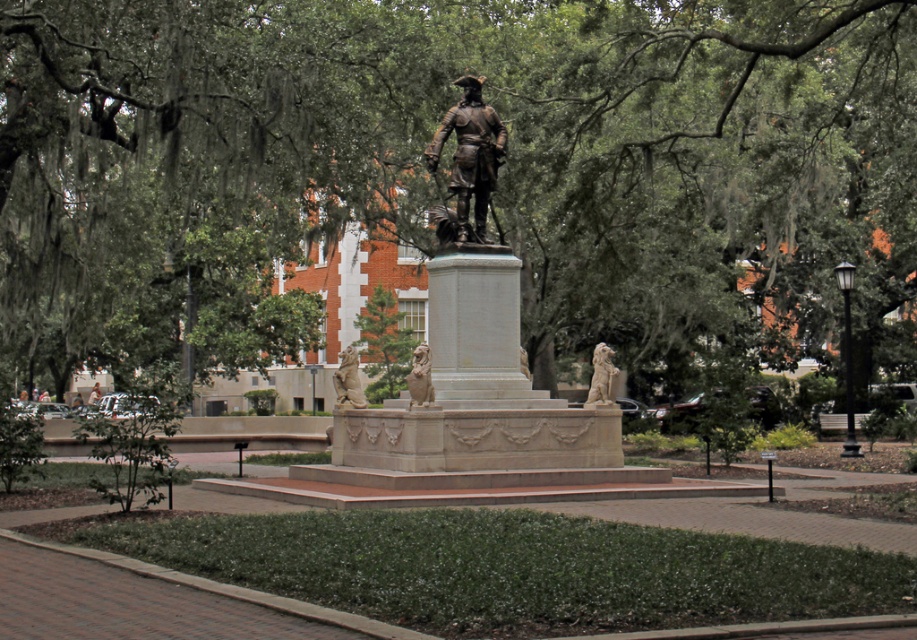
Can you confirm if shiny bronze statue at center is thinner than beige stone lion at center?

Incorrect, shiny bronze statue at center's width is not less than beige stone lion at center's.

Locate an element on the screen. shiny bronze statue at center is located at coordinates click(468, 161).

Between point (431, 433) and point (91, 390), which one is positioned in front?

Point (431, 433) is in front.

Can you confirm if bronze statue at center is positioned above light brown wooden bench at center?

Yes.

You are a GUI agent. You are given a task and a screenshot of the screen. Output one action in this format:
    pyautogui.click(x=<x>, y=<y>)
    Task: Click on the bronze statue at center
    
    Given the screenshot: What is the action you would take?
    pyautogui.click(x=476, y=349)

Can you confirm if shiny bronze statue at center is bigger than bronze lion at center?

Correct, shiny bronze statue at center is larger in size than bronze lion at center.

Does point (432, 152) lie behind point (428, 394)?

Yes, point (432, 152) is farther from viewer.

Between point (490, 186) and point (426, 362), which one is positioned behind?

The point (490, 186) is behind.

At what (x,y) coordinates should I click in order to perform the action: click on shiny bronze statue at center. Please return your answer as a coordinate pair (x, y). Looking at the image, I should click on (468, 161).